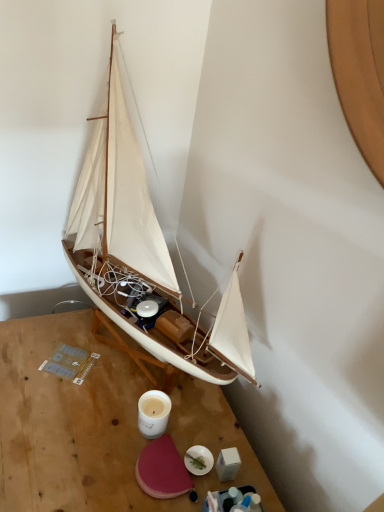
Where is `free point above wooden table at center (from a real-world perspective)`? This screenshot has height=512, width=384. free point above wooden table at center (from a real-world perspective) is located at coordinates (92, 402).